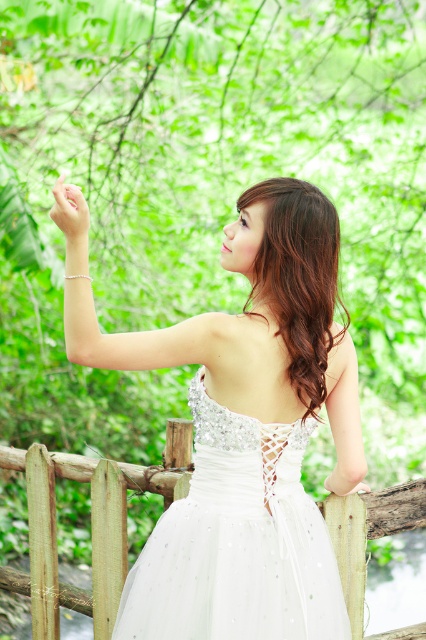
Based on the scene description, where is the white satin dress at center located in terms of its 2D coordinates?

The white satin dress at center is located at the 2D coordinates of point (250,419).

You are a photographer taking a picture of the woman on the bridge. You notice two points in the scene marked as point 1 at (264, 540) and point 2 at (97, 624). Which point is closer to your camera lens?

Point 1 at (264, 540) is closer to the viewer than point 2 at (97, 624).